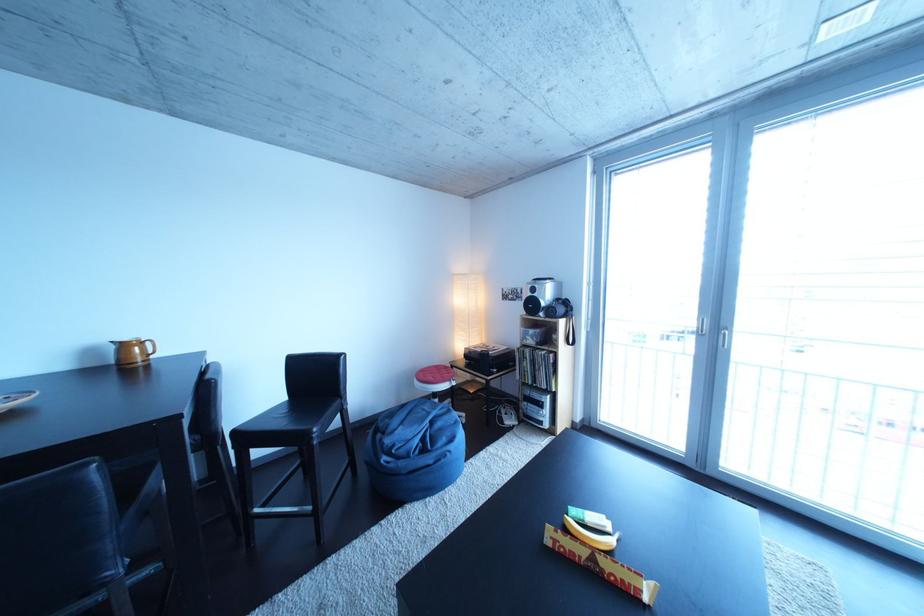
I want to click on green candy wrapper, so click(590, 519).